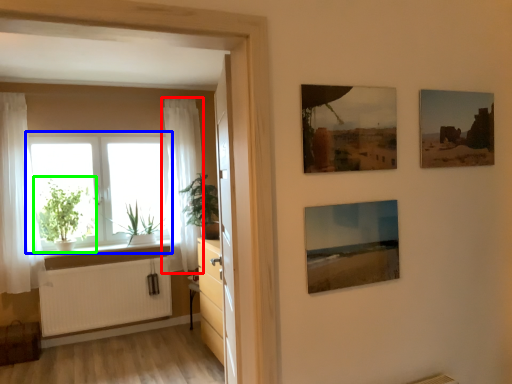
Question: Estimate the real-world distances between objects in this image. Which object is farther from curtain (highlighted by a red box), window (highlighted by a blue box) or houseplant (highlighted by a green box)?

Choices:
 (A) window
 (B) houseplant

Answer: (B)